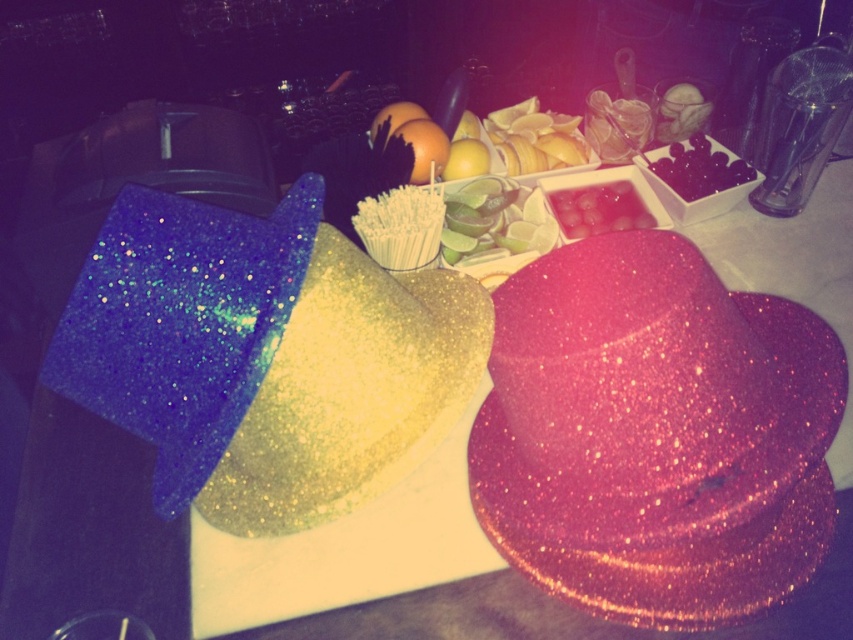
Between green matte lime at center and pink glittery watermelon at center, which one appears on the right side from the viewer's perspective?

pink glittery watermelon at center is more to the right.

Is point (454, 211) in front of point (628, 227)?

Yes, it is in front of point (628, 227).

Where is `green matte lime at center`? This screenshot has height=640, width=853. green matte lime at center is located at coordinates (494, 221).

Is green matte lime at center thinner than black glossy grapes at upper right?

In fact, green matte lime at center might be wider than black glossy grapes at upper right.

Does green matte lime at center appear on the right side of black glossy grapes at upper right?

In fact, green matte lime at center is to the left of black glossy grapes at upper right.

Between point (477, 227) and point (724, 189), which one is positioned behind?

The point (724, 189) is more distant.

You are a GUI agent. You are given a task and a screenshot of the screen. Output one action in this format:
    pyautogui.click(x=<x>, y=<y>)
    Task: Click on the green matte lime at center
    
    Given the screenshot: What is the action you would take?
    pyautogui.click(x=494, y=221)

Can you confirm if pink glittery hat at center is shorter than pink glittery watermelon at center?

In fact, pink glittery hat at center may be taller than pink glittery watermelon at center.

Can you confirm if pink glittery hat at center is bigger than pink glittery watermelon at center?

Indeed, pink glittery hat at center has a larger size compared to pink glittery watermelon at center.

Who is more forward, (656, 605) or (582, 211)?

Point (656, 605)

Find the location of a particular element. The image size is (853, 640). pink glittery hat at center is located at coordinates (654, 433).